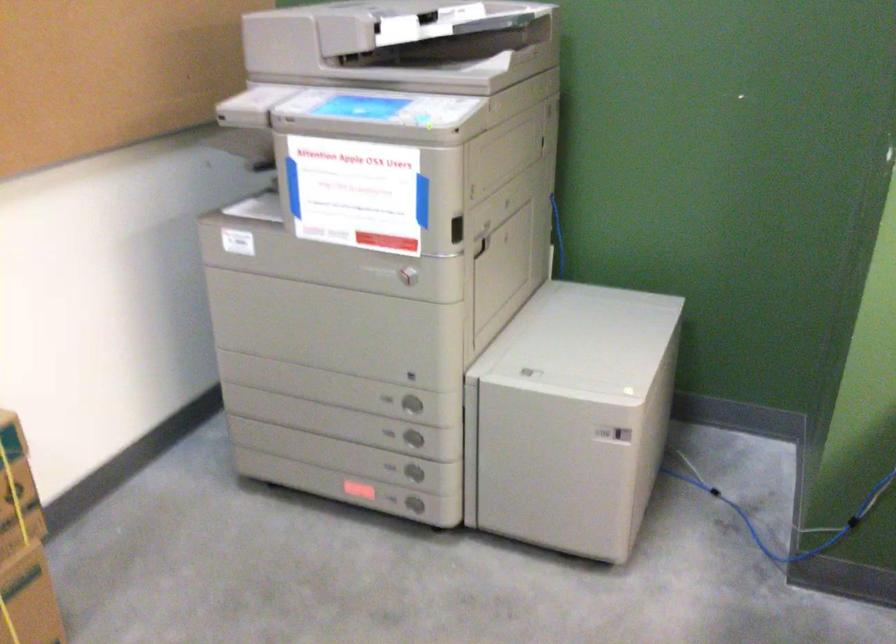
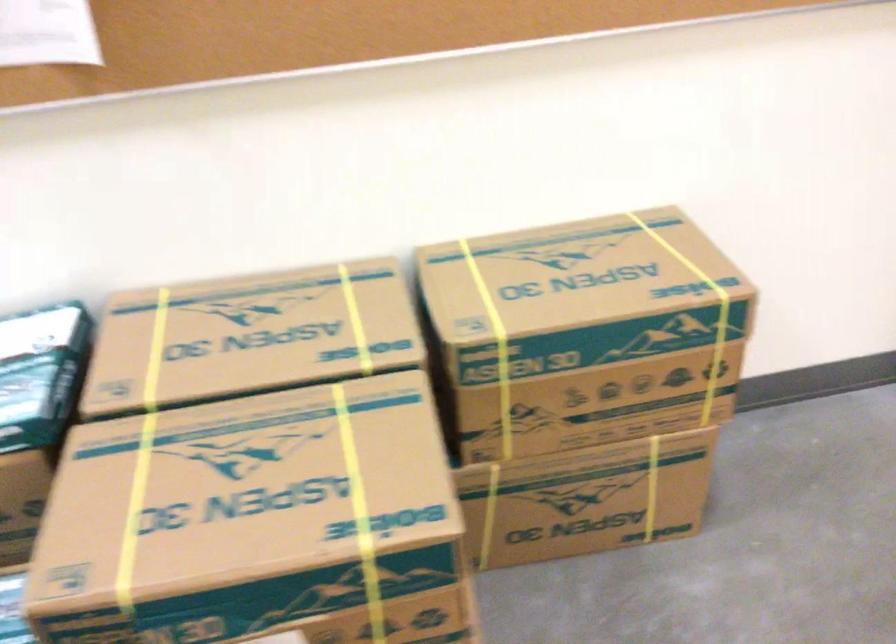
First-person continuous shooting, in which direction is the camera rotating?

The camera rotated toward left-down.